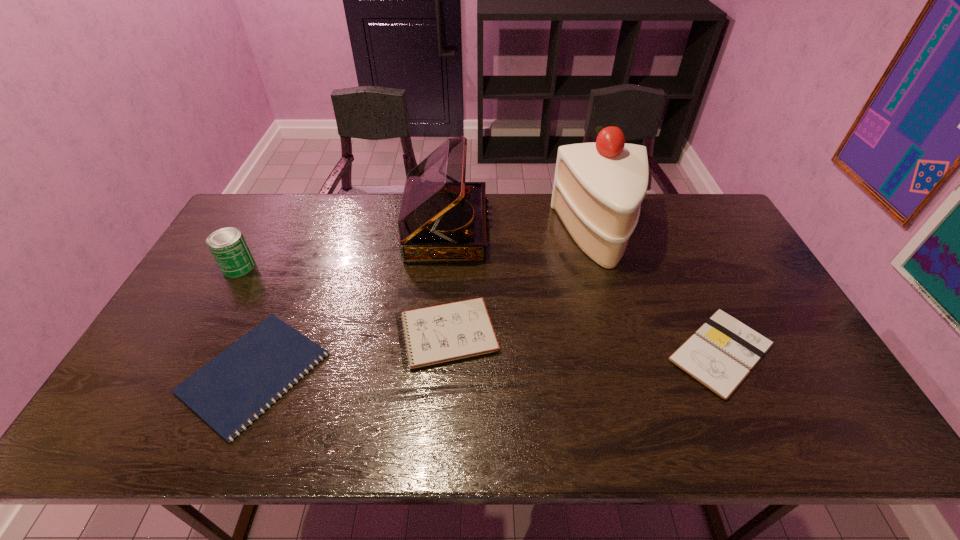
Locate an element on the screen. The image size is (960, 540). blank region between the second shortest notepad and the shortest notepad is located at coordinates (488, 362).

This screenshot has height=540, width=960. What are the coordinates of `empty space that is in between the second shortest object and the fifth shortest object` in the screenshot? It's located at (584, 291).

The height and width of the screenshot is (540, 960). Identify the location of vacant point located between the second tallest object and the cake. (523, 232).

This screenshot has width=960, height=540. I want to click on empty space that is in between the tallest notepad and the shortest object, so click(x=350, y=353).

Where is `free spot between the shortest object and the second notepad from right to left`? This screenshot has height=540, width=960. free spot between the shortest object and the second notepad from right to left is located at coordinates (350, 353).

Find the location of a particular element. vacant space that is in between the rightmost notepad and the fourth tallest object is located at coordinates (584, 343).

What are the coordinates of `free spot between the record player and the second notepad from left to right` in the screenshot? It's located at 446,282.

At what (x,y) coordinates should I click in order to perform the action: click on the second closest object relative to the tallest object. Please return your answer as a coordinate pair (x, y). Looking at the image, I should click on coord(442,218).

Select which object is the fifth closest to the leftmost notepad. Please provide its 2D coordinates. Your answer should be formatted as a tuple, i.e. [(x, y)], where the tuple contains the x and y coordinates of a point satisfying the conditions above.

[(721, 353)]

Choose which notepad is the second nearest neighbor to the can. Please provide its 2D coordinates. Your answer should be formatted as a tuple, i.e. [(x, y)], where the tuple contains the x and y coordinates of a point satisfying the conditions above.

[(442, 333)]